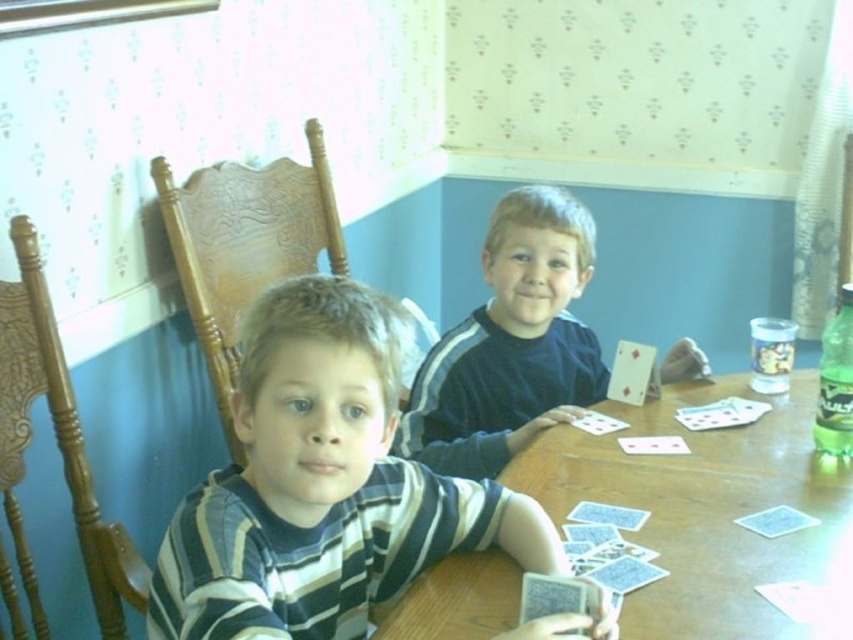
Question: Does striped cotton shirt at center have a smaller size compared to blue cardboard cards at lower center?

Choices:
 (A) no
 (B) yes

Answer: (A)

Question: Which of the following is the farthest from the observer?

Choices:
 (A) red glossy playing card at center
 (B) blue cardboard cards at lower center
 (C) striped cotton shirt at center
 (D) dark blue jersey at center

Answer: (A)

Question: Which is nearer to the blue cardboard cards at lower center?

Choices:
 (A) dark blue jersey at center
 (B) striped cotton shirt at center

Answer: (B)

Question: Does wooden at center appear on the right side of dark blue jersey at center?

Choices:
 (A) no
 (B) yes

Answer: (B)

Question: Which point is farther to the camera?

Choices:
 (A) wooden at center
 (B) blue cardboard cards at lower center

Answer: (B)

Question: Can you confirm if wooden at center is thinner than red glossy playing card at center?

Choices:
 (A) yes
 (B) no

Answer: (B)